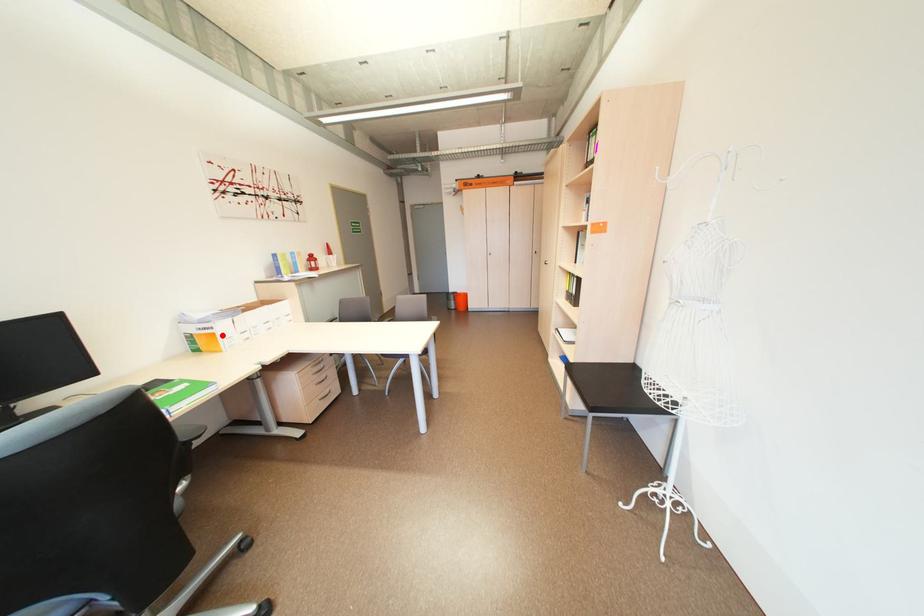
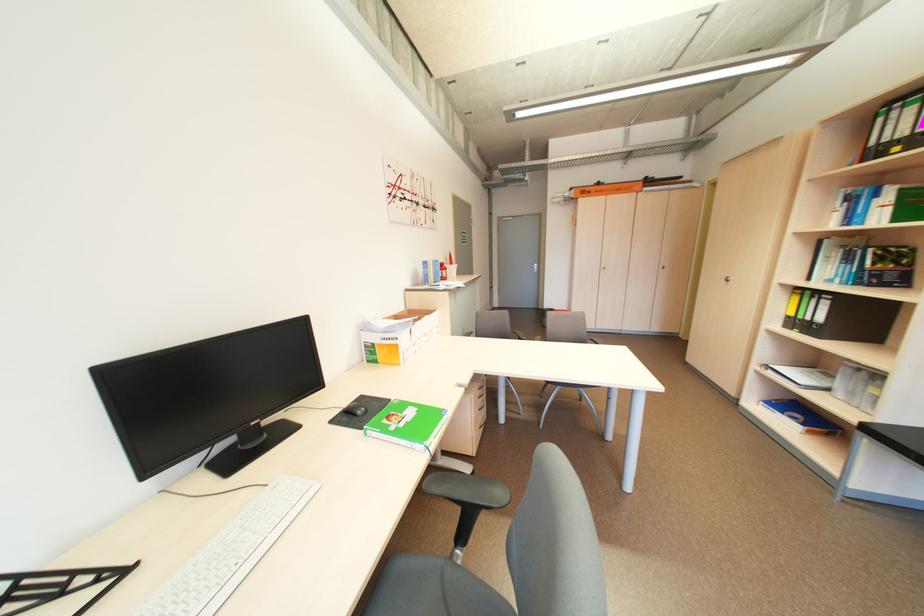
Question: I am providing you with two images of the same scene from different viewpoints. In image1, a red point is highlighted. Considering the same 3D point in image2, which of the following is correct?

Choices:
 (A) It is closer
 (B) It is farther

Answer: (B)